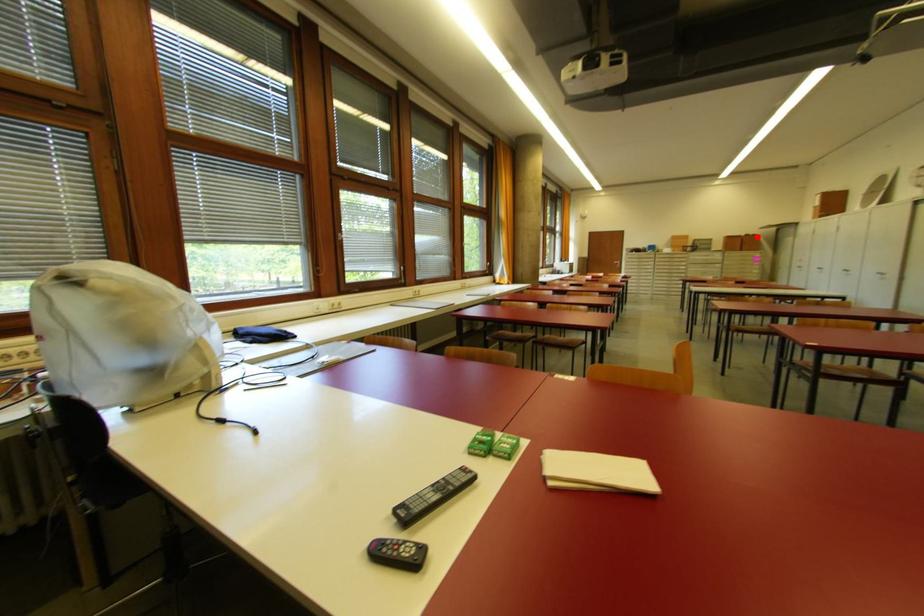
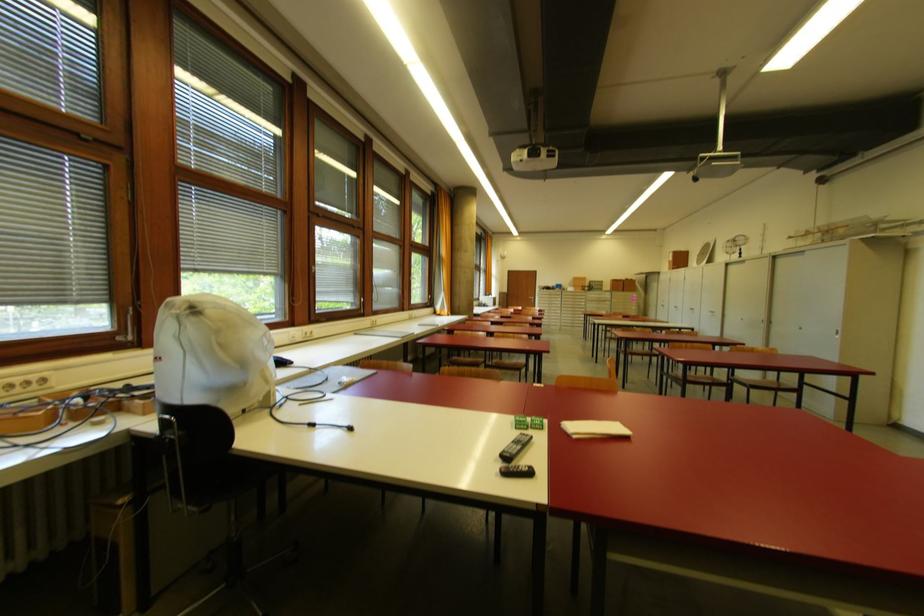
In the second image, find the point that corresponds to the highlighted location in the first image.

(634, 281)